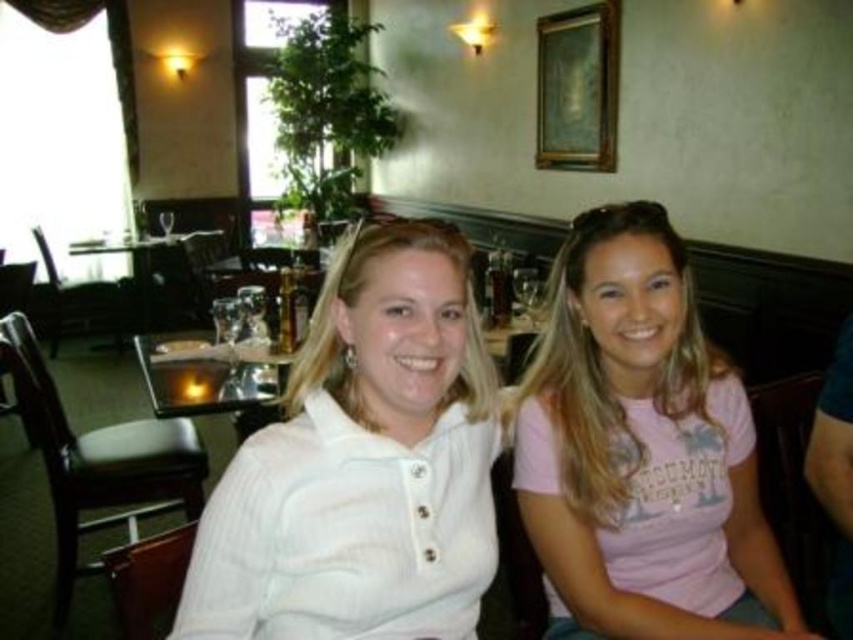
Measure the distance between pink cotton shirt at center and wooden table at center.

pink cotton shirt at center and wooden table at center are 4.32 meters apart.

Is pink cotton shirt at center further to camera compared to wooden table at center?

That is False.

Who is more forward, (563, 452) or (135, 252)?

Positioned in front is point (563, 452).

The height and width of the screenshot is (640, 853). I want to click on pink cotton shirt at center, so click(x=642, y=451).

Is white ribbed polo shirt at center wider than wooden table at center?

Incorrect, white ribbed polo shirt at center's width does not surpass wooden table at center's.

Which of these two, white ribbed polo shirt at center or wooden table at center, stands shorter?

With less height is white ribbed polo shirt at center.

Is point (367, 444) behind point (148, 288)?

That is False.

Identify the location of white ribbed polo shirt at center. 363,464.

How far apart are white ribbed polo shirt at center and pink cotton shirt at center?

white ribbed polo shirt at center and pink cotton shirt at center are 12.37 inches apart from each other.

This screenshot has width=853, height=640. I want to click on white ribbed polo shirt at center, so click(x=363, y=464).

Does point (270, 557) come farther from viewer compared to point (553, 364)?

No.

What are the coordinates of `white ribbed polo shirt at center` in the screenshot? It's located at (363, 464).